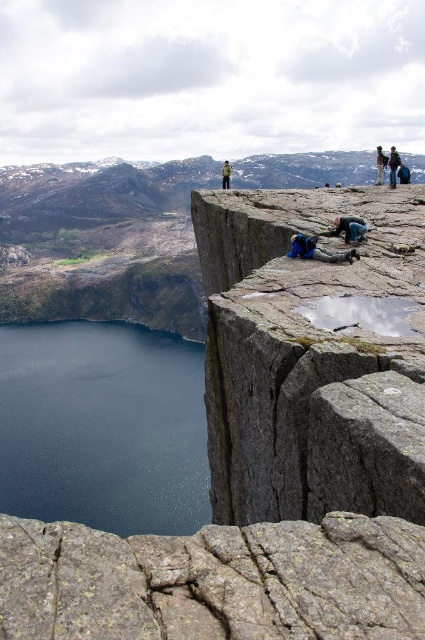
Based on the photo, you are planning to take a photo of the gray rough rock at center and the dark blue water at lower left. Which object takes up more area in the image?

The dark blue water at lower left occupies more space than the gray rough rock at center in the image.

You are a photographer planning to capture a wide shot of the mountain peak. You notice two points marked on your map at coordinates point [376,621] and point [74,493]. Which point should you prioritize focusing on to ensure it appears sharp in your photo if you want the closest object to the camera to be in focus?

You should prioritize focusing on point [376,621] because it is closer to the camera than point [74,493], ensuring that the closest object will be in sharp focus.

You are a hiker planning to take a photo of the gray rough rock at lower center and the dark blue water at lower left from the mountain peak. Which object should you position yourself closer to in order to capture both in the same frame?

To capture both the gray rough rock at lower center and the dark blue water at lower left in the same frame, you should position yourself closer to the gray rough rock at lower center since it is above the dark blue water at lower left, allowing both to be included within the camera view.